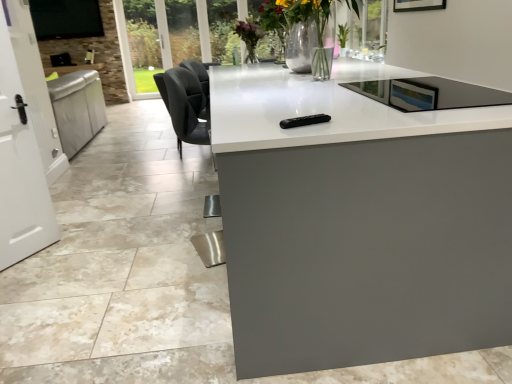
Identify the location of vacant space in front of white glossy door at left. The image size is (512, 384). tap(26, 279).